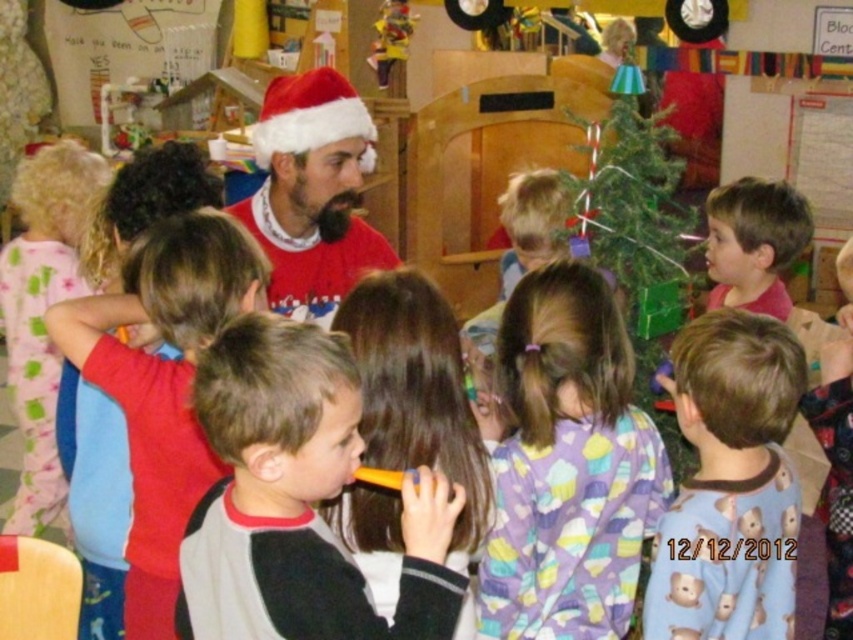
You are a parent looking for your child who is holding an orange plastic toothbrush at center. The child is standing near a green matte christmas tree at center. Which direction should you look relative to the tree to find them?

The orange plastic toothbrush at center is to the left of the green matte christmas tree at center, so you should look to the left side of the tree to find your child.

You are standing in the festive classroom and want to take a photo of the two points mentioned. Which point, point (395, 508) or point (697, 221), will appear larger in your camera view?

Point (395, 508) is closer to the camera than point (697, 221), so it will appear larger in the camera view.

You are a parent standing in the playroom and see the orange plastic toothbrush at center. If you want to pick it up, will you be able to reach it without moving your feet?

The orange plastic toothbrush at center is 1.29 meters away from the viewer. Since the average adult arm length is about 0.7 meters, you would not be able to reach it without moving your feet.